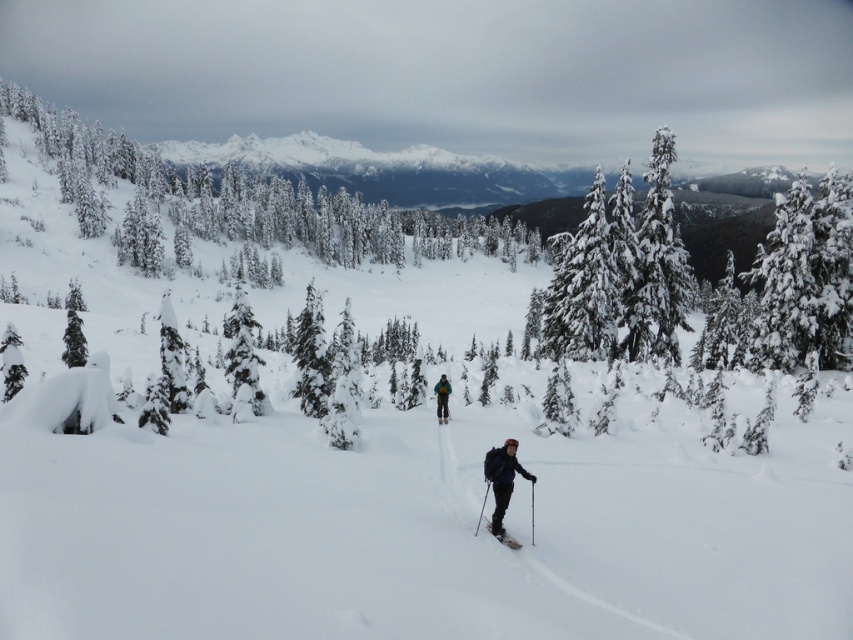
Does dark blue jacket at center lie behind matte black ski at center?

No, dark blue jacket at center is closer to the viewer.

Can you confirm if dark blue jacket at center is bigger than matte black ski at center?

Indeed, dark blue jacket at center has a larger size compared to matte black ski at center.

Describe the element at coordinates (502, 480) in the screenshot. This screenshot has width=853, height=640. I see `dark blue jacket at center` at that location.

Locate an element on the screen. dark blue jacket at center is located at coordinates (502, 480).

The width and height of the screenshot is (853, 640). Identify the location of snow-covered evergreen tree at center. (242, 358).

Is point (233, 348) behind point (488, 522)?

Yes, point (233, 348) is behind point (488, 522).

Where is `snow-covered evergreen tree at center`? snow-covered evergreen tree at center is located at coordinates (242, 358).

Does point (663, 220) lie in front of point (235, 358)?

That is False.

Who is positioned more to the right, green textured tree at upper right or snow-covered evergreen tree at center?

From the viewer's perspective, green textured tree at upper right appears more on the right side.

Identify the location of green textured tree at upper right. The image size is (853, 640). (657, 266).